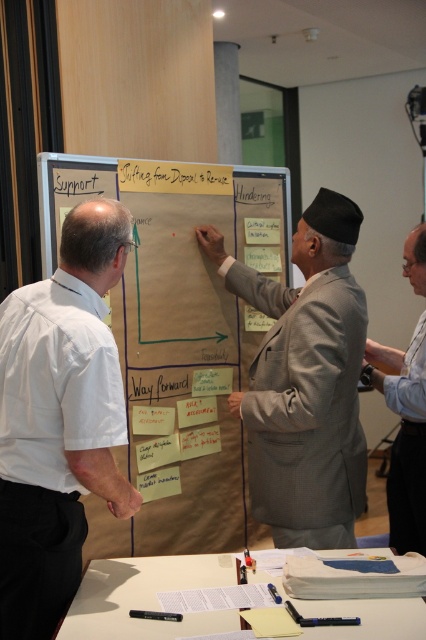
You are a photographer trying to capture a clear shot of both the white shirt at left and the white paper at lower center. Considering their sizes, which object should you focus on first to ensure it appears sharp in the photo?

The white shirt at left is thinner than the white paper at lower center, so you should focus on the white paper at lower center first to ensure it appears sharp in the photo.